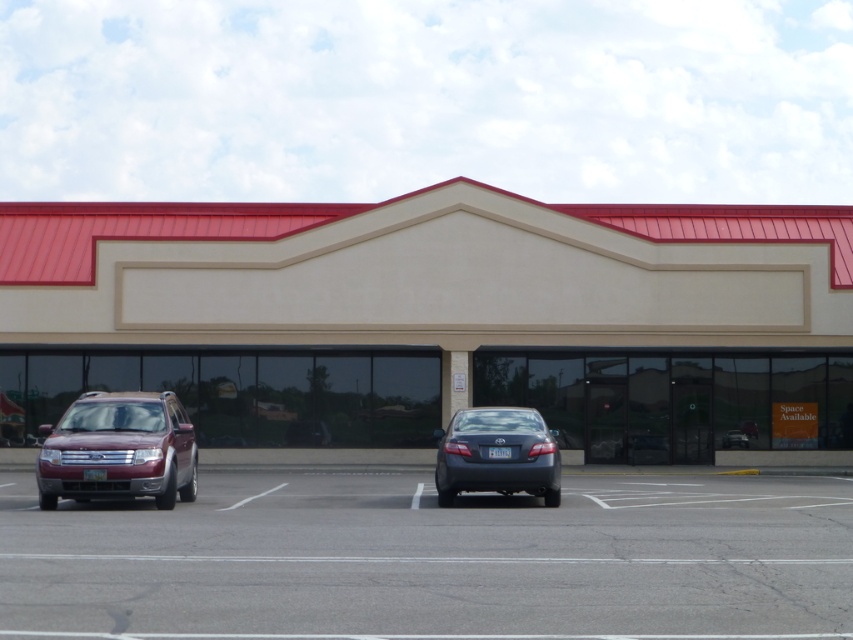
You are standing in the parking lot of the commercial building and want to check if the shiny maroon suv at left is within a 20 meter safety zone. Is it within the zone?

The shiny maroon suv at left is 19.84 meters away from the viewer, which is within the 20 meter safety zone.

You are a delivery driver who needs to back out of the parking spot between the shiny maroon suv at left and the gray metallic sedan at center. Based on their positions, which vehicle should you be cautious not to hit when reversing?

The shiny maroon suv at left is above the gray metallic sedan at center, so when reversing, you should be cautious not to hit the shiny maroon suv at left which is positioned higher up.

Consider the image. You are standing in front of the commercial building and notice two points marked on the image. The first point is at coordinates point [538,230] and the second is at point [149,394]. Which point is closer to you?

Point [149,394] is closer to you because it is less further to the camera than point [538,230].